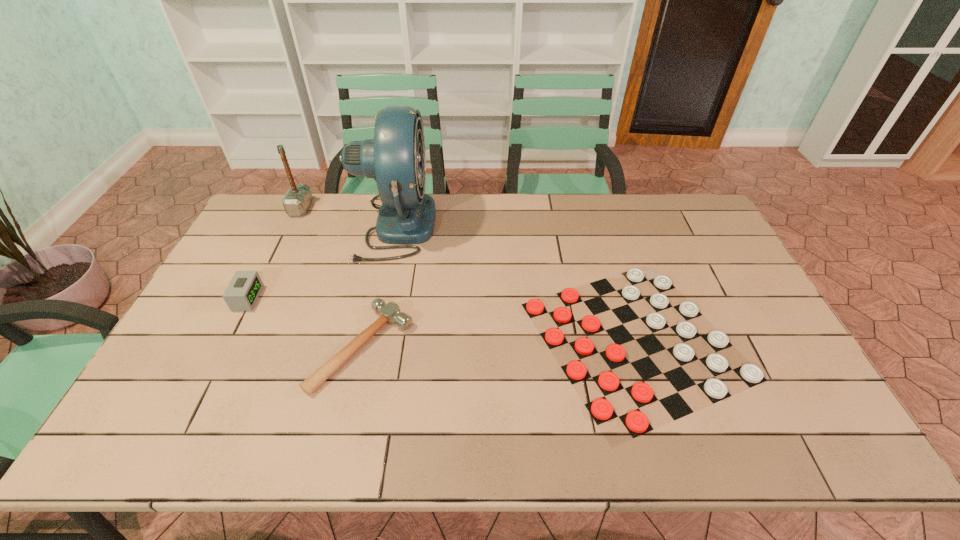
Where is `the tallest object`? Image resolution: width=960 pixels, height=540 pixels. the tallest object is located at coordinates (396, 158).

Identify the location of the taller hammer. (298, 197).

Where is `the fourth shortest object`? This screenshot has width=960, height=540. the fourth shortest object is located at coordinates (298, 197).

Locate an element on the screen. the third tallest object is located at coordinates (241, 294).

Locate an element on the screen. This screenshot has height=540, width=960. the shorter hammer is located at coordinates (390, 313).

Find the location of a particular element. the nearer hammer is located at coordinates (390, 313).

Where is `the shortest object`? The width and height of the screenshot is (960, 540). the shortest object is located at coordinates (601, 410).

Locate an element on the screen. This screenshot has height=540, width=960. checkerboard is located at coordinates (601, 410).

This screenshot has width=960, height=540. In order to click on vacant area situated 0.090m in front of the tallest object to blow air in this screenshot , I will do `click(460, 226)`.

Where is `vacant region located 0.220m on the striking surface of the farther hammer`? This screenshot has height=540, width=960. vacant region located 0.220m on the striking surface of the farther hammer is located at coordinates (370, 208).